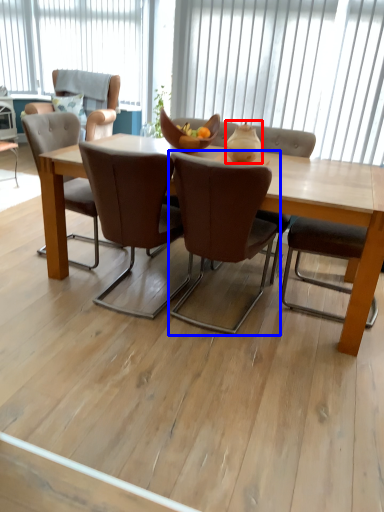
Question: Among these objects, which one is nearest to the camera, vase (highlighted by a red box) or chair (highlighted by a blue box)?

Choices:
 (A) vase
 (B) chair

Answer: (B)